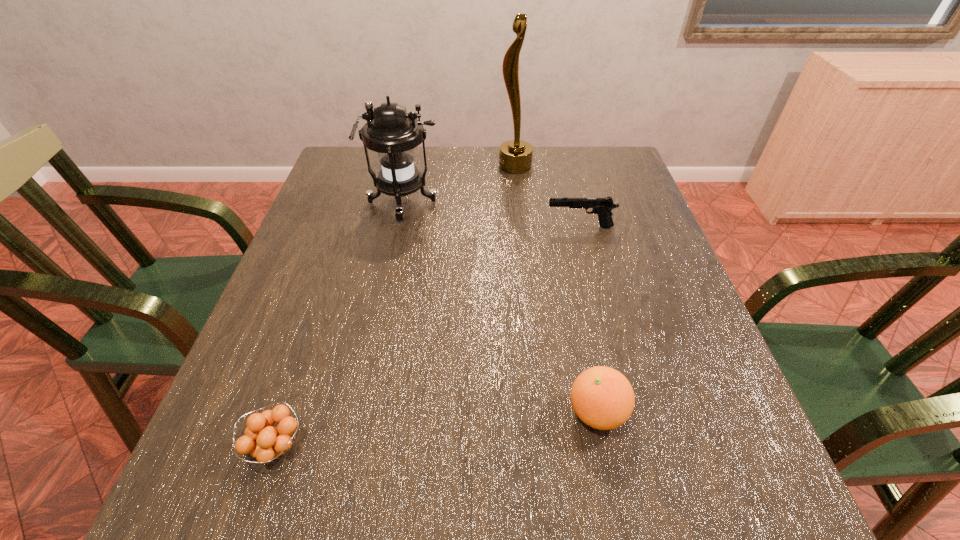
Point out which object is positioned as the nearest to the farthest object. Please provide its 2D coordinates. Your answer should be formatted as a tuple, i.e. [(x, y)], where the tuple contains the x and y coordinates of a point satisfying the conditions above.

[(390, 131)]

Choose which object is the nearest neighbor to the gun. Please provide its 2D coordinates. Your answer should be formatted as a tuple, i.e. [(x, y)], where the tuple contains the x and y coordinates of a point satisfying the conditions above.

[(515, 156)]

Locate an element on the screen. blank space that satisfies the following two spatial constraints: 1. on the front-facing side of the right orange fruit; 2. on the left side of the farthest object is located at coordinates (541, 412).

Find the location of a particular element. vacant point that satisfies the following two spatial constraints: 1. on the front-facing side of the tallest object; 2. on the back side of the taller orange fruit is located at coordinates (541, 412).

Where is `vacant space that satisfies the following two spatial constraints: 1. on the front-facing side of the award; 2. on the front side of the left orange fruit`? vacant space that satisfies the following two spatial constraints: 1. on the front-facing side of the award; 2. on the front side of the left orange fruit is located at coordinates (545, 447).